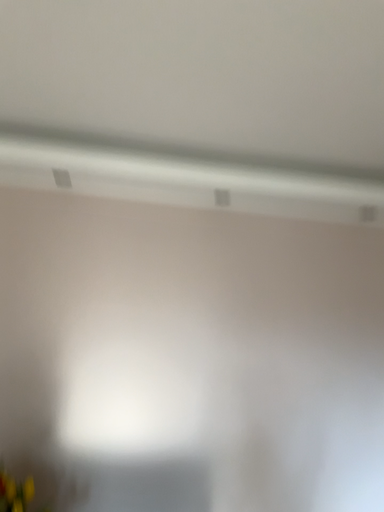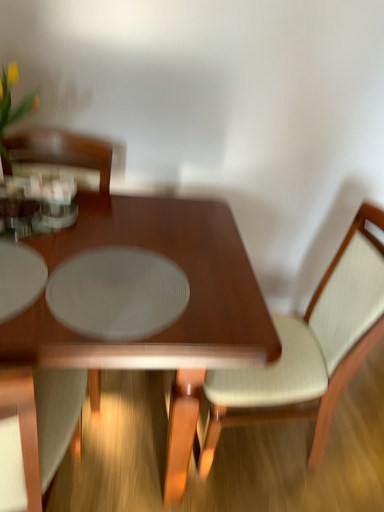
Question: How did the camera likely rotate when shooting the video?

Choices:
 (A) rotated downward
 (B) rotated upward

Answer: (A)